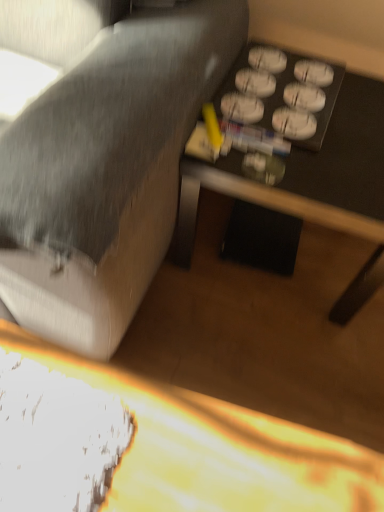
Question: Does textured gray fabric couch at center lie behind black plastic table at lower right, the 2th table when ordered from bottom to top?

Choices:
 (A) yes
 (B) no

Answer: (B)

Question: Could you tell me if textured gray fabric couch at center is turned towards black plastic table at lower right, the 2th table when ordered from bottom to top?

Choices:
 (A) yes
 (B) no

Answer: (B)

Question: Is textured gray fabric couch at center turned away from black plastic table at lower right, the 2th table when ordered from bottom to top?

Choices:
 (A) yes
 (B) no

Answer: (B)

Question: Is textured gray fabric couch at center to the left of black plastic table at lower right, the 2th table when ordered from bottom to top, from the viewer's perspective?

Choices:
 (A) no
 (B) yes

Answer: (B)

Question: Would you consider textured gray fabric couch at center to be distant from black plastic table at lower right, the 2th table when ordered from bottom to top?

Choices:
 (A) no
 (B) yes

Answer: (A)

Question: Choose the correct answer: Is wooden table at center, which appears as the first table when ordered from the bottom, inside textured gray fabric couch at center or outside it?

Choices:
 (A) outside
 (B) inside

Answer: (A)

Question: In terms of width, does wooden table at center, which is the second table from top to bottom, look wider or thinner when compared to textured gray fabric couch at center?

Choices:
 (A) wide
 (B) thin

Answer: (A)

Question: Is wooden table at center, which appears as the first table when ordered from the bottom, to the left or to the right of textured gray fabric couch at center in the image?

Choices:
 (A) left
 (B) right

Answer: (B)

Question: Is point (145, 411) positioned closer to the camera than point (109, 195)?

Choices:
 (A) closer
 (B) farther

Answer: (B)

Question: Is point (61, 330) positioned closer to the camera than point (117, 492)?

Choices:
 (A) closer
 (B) farther

Answer: (B)

Question: From the image's perspective, relative to wooden table at center, which is the second table from top to bottom, is textured gray fabric couch at center above or below?

Choices:
 (A) above
 (B) below

Answer: (A)

Question: From their relative heights in the image, would you say textured gray fabric couch at center is taller or shorter than wooden table at center, which is the second table from top to bottom?

Choices:
 (A) short
 (B) tall

Answer: (B)

Question: Is textured gray fabric couch at center inside the boundaries of wooden table at center, which is the second table from top to bottom, or outside?

Choices:
 (A) outside
 (B) inside

Answer: (A)

Question: Based on their sizes in the image, would you say black plastic table at lower right, acting as the first table starting from the top, is bigger or smaller than wooden table at center, which is the second table from top to bottom?

Choices:
 (A) big
 (B) small

Answer: (A)

Question: Is black plastic table at lower right, acting as the first table starting from the top, wider or thinner than wooden table at center, which is the second table from top to bottom?

Choices:
 (A) wide
 (B) thin

Answer: (B)